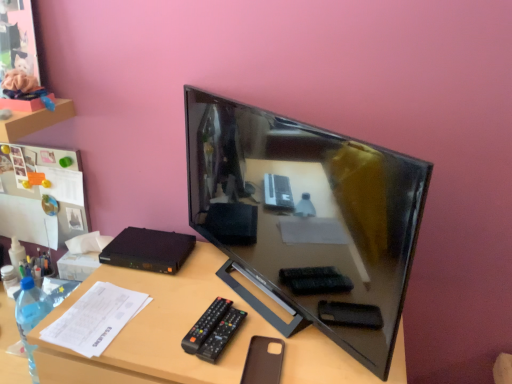
Identify the location of free point to the left of brown leather phone case at lower center. The width and height of the screenshot is (512, 384). (186, 350).